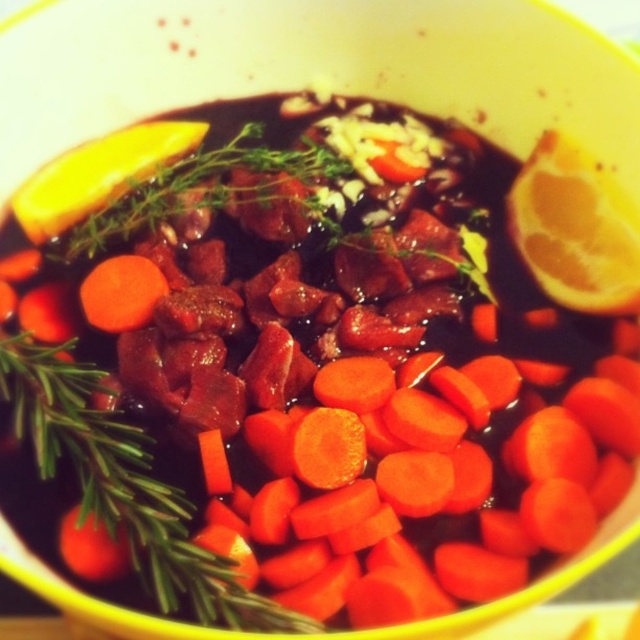
Question: Is bright orange carrot at center in front of orange smooth carrot at center?

Choices:
 (A) yes
 (B) no

Answer: (A)

Question: Which object appears farthest from the camera in this image?

Choices:
 (A) orange smooth carrot at center
 (B) bright orange carrot at center
 (C) matte yellow lemon at upper right

Answer: (C)

Question: Observing the image, what is the correct spatial positioning of bright orange carrot at center in reference to orange smooth carrot at center?

Choices:
 (A) above
 (B) below

Answer: (B)

Question: Among these points, which one is farthest from the camera?

Choices:
 (A) (250, 448)
 (B) (600, 202)
 (C) (131, 292)

Answer: (B)

Question: Which point appears closest to the camera in this image?

Choices:
 (A) (493, 572)
 (B) (100, 285)
 (C) (564, 211)

Answer: (A)

Question: Can you confirm if bright orange carrot at center is bigger than matte yellow lemon at upper right?

Choices:
 (A) no
 (B) yes

Answer: (B)